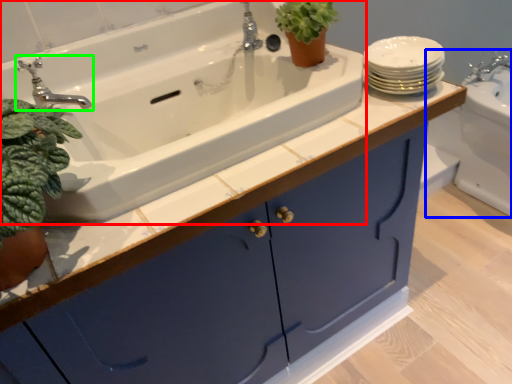
Question: Which object is positioned closest to sink (highlighted by a red box)? Select from sink (highlighted by a blue box) and tap (highlighted by a green box).

Choices:
 (A) sink
 (B) tap

Answer: (B)